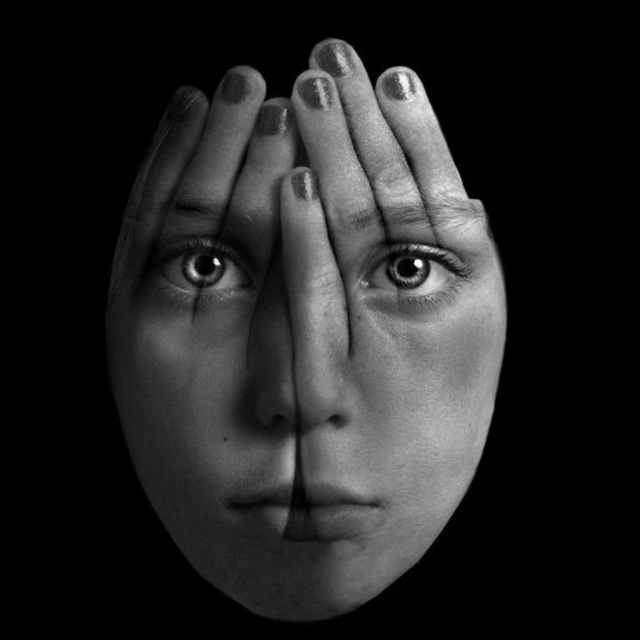
Question: Where is smooth skin forehead at center located in relation to shiny gray eye at center in the image?

Choices:
 (A) left
 (B) right

Answer: (B)

Question: Which of the following is the farthest from the observer?

Choices:
 (A) smooth skin forehead at center
 (B) shiny gray eye at center

Answer: (B)

Question: Which point is farther to the camera?

Choices:
 (A) shiny gray eye at center
 (B) smooth skin face at center

Answer: (A)

Question: Does smooth skin face at center appear under smooth skin forehead at center?

Choices:
 (A) no
 (B) yes

Answer: (B)

Question: Which point appears farthest from the camera in this image?

Choices:
 (A) (428, 234)
 (B) (452, 266)
 (C) (339, 96)

Answer: (B)

Question: Can you confirm if smooth skin face at center is wider than smooth gray eye at center?

Choices:
 (A) no
 (B) yes

Answer: (B)